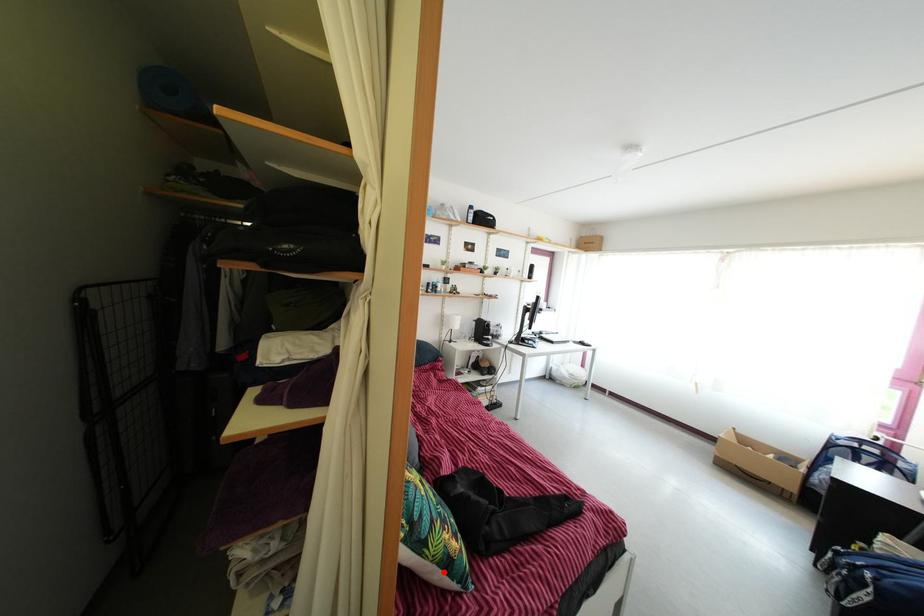
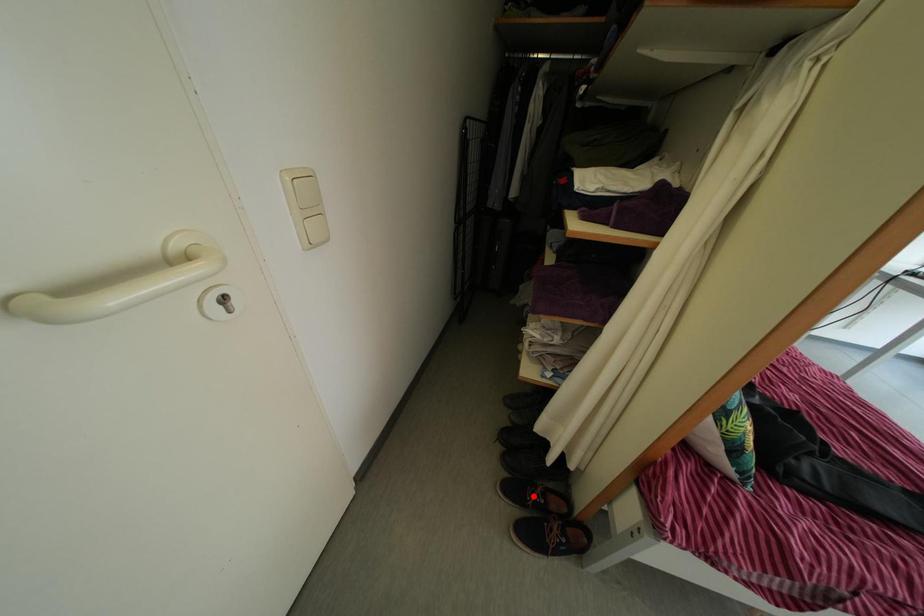
I am providing you with two images of the same scene from different viewpoints. A red point is marked on the first image and another point is marked on the second image. Does the point marked in image1 correspond to the same location as the one in image2?

No